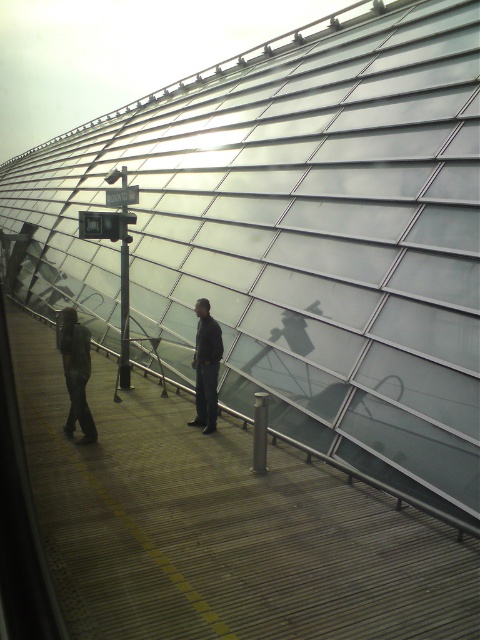
You are a visitor at this modern architectural site and want to take a photo of the wooden walkway at center and dark gray jacket at center. Which object should you focus on first to ensure it appears larger in your photo?

The wooden walkway at center is bigger than the dark gray jacket at center, so you should focus on the wooden walkway at center first to ensure it appears larger in your photo.